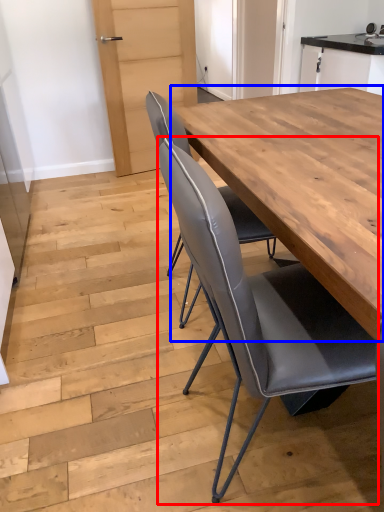
Question: Which of the following is the closest to the observer, chair (highlighted by a red box) or table (highlighted by a blue box)?

Choices:
 (A) chair
 (B) table

Answer: (A)